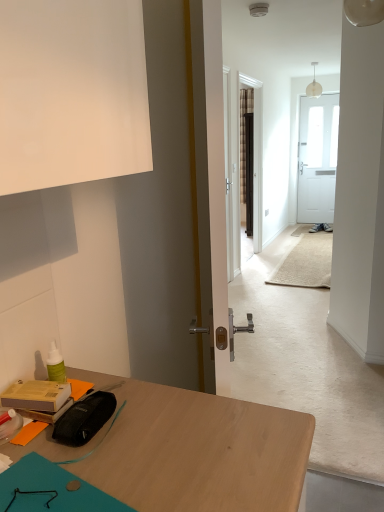
Question: In terms of height, does matte black pouch at lower left, the 2th stationery when ordered from left to right, look taller or shorter compared to matte cardboard box at lower left, acting as the 2th stationery starting from the right?

Choices:
 (A) short
 (B) tall

Answer: (A)

Question: Which is correct: matte black pouch at lower left, the 2th stationery when ordered from left to right, is inside matte cardboard box at lower left, acting as the 2th stationery starting from the right, or outside of it?

Choices:
 (A) inside
 (B) outside

Answer: (B)

Question: Estimate the real-world distances between objects in this image. Which object is farther from the matte black pouch at lower left, the 1th stationery positioned from the right?

Choices:
 (A) translucent glass pendant light at upper center
 (B) matte cardboard box at lower left, acting as the 2th stationery starting from the right

Answer: (A)

Question: Based on their relative distances, which object is farther from the matte black pouch at lower left, the 1th stationery positioned from the right?

Choices:
 (A) translucent glass pendant light at upper center
 (B) matte cardboard box at lower left, the first stationery when ordered from left to right

Answer: (A)